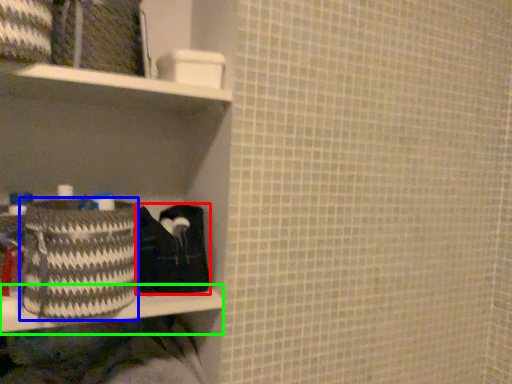
Question: Which object is positioned farthest from material (highlighted by a red box)? Select from basket (highlighted by a blue box) and ledge (highlighted by a green box).

Choices:
 (A) basket
 (B) ledge

Answer: (A)